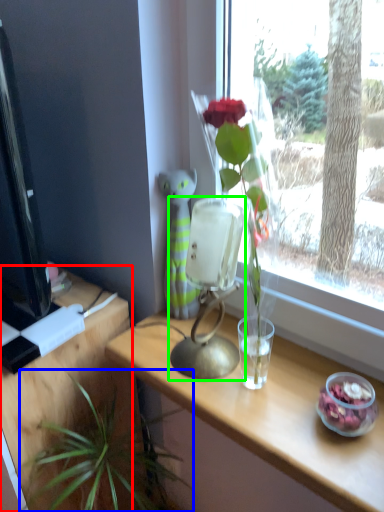
Question: Based on their relative distances, which object is nearer to table (highlighted by a red box)? Choose from houseplant (highlighted by a blue box) and table lamp (highlighted by a green box).

Choices:
 (A) houseplant
 (B) table lamp

Answer: (A)